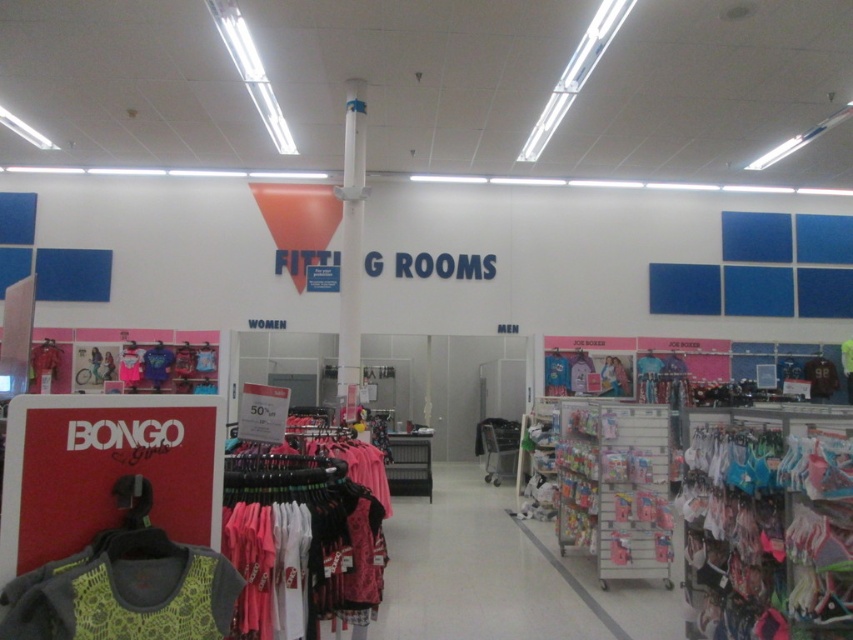
Question: Which point is closer to the camera taking this photo?

Choices:
 (A) (202, 627)
 (B) (471, 472)

Answer: (A)

Question: Can you confirm if pink fabric at center is bigger than lime green mesh tank top at lower left?

Choices:
 (A) yes
 (B) no

Answer: (B)

Question: Considering the relative positions of pink fabric at center and lime green mesh tank top at lower left in the image provided, where is pink fabric at center located with respect to lime green mesh tank top at lower left?

Choices:
 (A) below
 (B) above

Answer: (A)

Question: Is pink fabric at center below lime green mesh tank top at lower left?

Choices:
 (A) no
 (B) yes

Answer: (B)